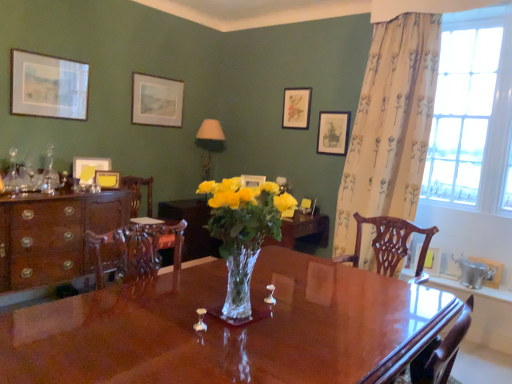
Describe the element at coordinates (89, 168) in the screenshot. Image resolution: width=512 pixels, height=384 pixels. I see `matte yellow picture frame at upper left, which is the eighth picture frame in right-to-left order` at that location.

You are a GUI agent. You are given a task and a screenshot of the screen. Output one action in this format:
    pyautogui.click(x=<x>, y=<y>)
    Task: Click on the matte white picture frame at upper left, which is the ninth picture frame in right-to-left order
    This screenshot has width=512, height=384.
    Given the screenshot: What is the action you would take?
    pyautogui.click(x=48, y=86)

What do you see at coordinates (243, 234) in the screenshot? I see `clear glass vase at center` at bounding box center [243, 234].

The width and height of the screenshot is (512, 384). Identify the location of matte white picture frame at center, acting as the sixth picture frame starting from the left. (308, 206).

Identify the location of yellow paper at left, positioned as the seventh picture frame in right-to-left order. The height and width of the screenshot is (384, 512). (106, 179).

Describe the element at coordinates (106, 179) in the screenshot. This screenshot has width=512, height=384. I see `yellow paper at left, the third picture frame when ordered from left to right` at that location.

Where is `metallic silver picture frame at lower right, the ninth picture frame in the left-to-right sequence`? Image resolution: width=512 pixels, height=384 pixels. metallic silver picture frame at lower right, the ninth picture frame in the left-to-right sequence is located at coordinates (490, 272).

Is mahogany wood cabinet at left not near matte paper picture frame at upper center, which appears as the sixth picture frame when viewed from the right?

Yes.

Is mahogany wood cabinet at left located outside matte paper picture frame at upper center, which appears as the sixth picture frame when viewed from the right?

Yes, mahogany wood cabinet at left is located beyond the bounds of matte paper picture frame at upper center, which appears as the sixth picture frame when viewed from the right.

Could you measure the distance between mahogany wood cabinet at left and matte paper picture frame at upper center, the fourth picture frame when ordered from left to right?

They are 1.30 meters apart.

Is mahogany wood cabinet at left turned away from matte paper picture frame at upper center, which appears as the sixth picture frame when viewed from the right?

mahogany wood cabinet at left is not turned away from matte paper picture frame at upper center, which appears as the sixth picture frame when viewed from the right.

Is point (330, 134) positioned before point (300, 208)?

No, it is not.

Which of these two, matte black picture frame at upper right, the 7th picture frame from the left, or matte white picture frame at center, placed as the 4th picture frame when sorted from right to left, is thinner?

Thinner between the two is matte black picture frame at upper right, the 7th picture frame from the left.

Based on the photo, considering the sizes of matte black picture frame at upper right, marked as the third picture frame in a right-to-left arrangement, and matte white picture frame at center, placed as the 4th picture frame when sorted from right to left, in the image, is matte black picture frame at upper right, marked as the third picture frame in a right-to-left arrangement, bigger or smaller than matte white picture frame at center, placed as the 4th picture frame when sorted from right to left,?

In the image, matte black picture frame at upper right, marked as the third picture frame in a right-to-left arrangement, appears to be larger than matte white picture frame at center, placed as the 4th picture frame when sorted from right to left.

This screenshot has width=512, height=384. Find the location of `houseplant in front of the clear glass window at upper right`. houseplant in front of the clear glass window at upper right is located at coordinates [243, 234].

Is clear glass vase at center with clear glass window at upper right?

clear glass vase at center and clear glass window at upper right are not in contact.

Considering the sizes of objects clear glass vase at center and clear glass window at upper right in the image provided, who is bigger, clear glass vase at center or clear glass window at upper right?

clear glass window at upper right is bigger.

Between point (241, 249) and point (437, 182), which one is positioned behind?

Positioned behind is point (437, 182).

Considering the sizes of objects matte white picture frame at upper left, which is the ninth picture frame in right-to-left order, and matte paper picture frame at upper center, the fourth picture frame when ordered from left to right, in the image provided, who is wider, matte white picture frame at upper left, which is the ninth picture frame in right-to-left order, or matte paper picture frame at upper center, the fourth picture frame when ordered from left to right,?

matte white picture frame at upper left, which is the ninth picture frame in right-to-left order, is wider.

From a real-world perspective, is matte white picture frame at upper left, which is the ninth picture frame in right-to-left order, positioned above or below matte paper picture frame at upper center, the fourth picture frame when ordered from left to right?

matte white picture frame at upper left, which is the ninth picture frame in right-to-left order, is situated lower than matte paper picture frame at upper center, the fourth picture frame when ordered from left to right, in the real world.

From their relative heights in the image, would you say matte white picture frame at upper left, which is the ninth picture frame in right-to-left order, is taller or shorter than matte paper picture frame at upper center, which appears as the sixth picture frame when viewed from the right?

matte white picture frame at upper left, which is the ninth picture frame in right-to-left order, is shorter than matte paper picture frame at upper center, which appears as the sixth picture frame when viewed from the right.

Is point (42, 107) positioned after point (323, 144)?

No, (42, 107) is in front of (323, 144).

Is matte white picture frame at upper left, the first picture frame positioned from the left, not near matte black picture frame at upper right, marked as the third picture frame in a right-to-left arrangement?

Yes, matte white picture frame at upper left, the first picture frame positioned from the left, and matte black picture frame at upper right, marked as the third picture frame in a right-to-left arrangement, are quite far apart.

Can we say matte white picture frame at upper left, which is the ninth picture frame in right-to-left order, lies outside matte black picture frame at upper right, the 7th picture frame from the left?

Indeed, matte white picture frame at upper left, which is the ninth picture frame in right-to-left order, is completely outside matte black picture frame at upper right, the 7th picture frame from the left.

Locate an element on the screen. This screenshot has height=384, width=512. the 6th picture frame to the left when counting from the matte black picture frame at upper right, the 7th picture frame from the left is located at coordinates (48, 86).

From the picture: How far apart are clear glass window at upper right and mahogany wood cabinet at left?

A distance of 9.45 feet exists between clear glass window at upper right and mahogany wood cabinet at left.

In the scene shown: From the image's perspective, who appears lower, clear glass window at upper right or mahogany wood cabinet at left?

mahogany wood cabinet at left.

Who is bigger, clear glass window at upper right or mahogany wood cabinet at left?

Bigger between the two is mahogany wood cabinet at left.

Is the surface of clear glass window at upper right in direct contact with mahogany wood cabinet at left?

No, clear glass window at upper right is not with mahogany wood cabinet at left.

From the image's perspective, is glossy wood desk at center above or below wooden picture frame at right, the 2th picture frame viewed from the right?

Clearly, from the image's perspective, glossy wood desk at center is below wooden picture frame at right, the 2th picture frame viewed from the right.

Who is smaller, glossy wood desk at center or wooden picture frame at right, the 2th picture frame viewed from the right?

wooden picture frame at right, the 2th picture frame viewed from the right, is smaller.

Which of these two, glossy wood desk at center or wooden picture frame at right, the 2th picture frame viewed from the right, is thinner?

With smaller width is wooden picture frame at right, the 2th picture frame viewed from the right.

From a real-world perspective, is glossy wood desk at center physically located above or below wooden picture frame at right, marked as the 8th picture frame in a left-to-right arrangement?

glossy wood desk at center is below wooden picture frame at right, marked as the 8th picture frame in a left-to-right arrangement.

You are a GUI agent. You are given a task and a screenshot of the screen. Output one action in this format:
    pyautogui.click(x=<x>, y=<y>)
    Task: Click on the cabinetry below the matte paper picture frame at upper center, the fourth picture frame when ordered from left to right (from a real-world perspective)
    This screenshot has height=384, width=512.
    Given the screenshot: What is the action you would take?
    pyautogui.click(x=54, y=235)

This screenshot has width=512, height=384. In order to click on the 1st picture frame counting from the right of the matte white picture frame at center, acting as the sixth picture frame starting from the left in this screenshot , I will do `click(333, 132)`.

Which object lies further to the anchor point yellow paper at left, the third picture frame when ordered from left to right, matte white picture frame at center, acting as the sixth picture frame starting from the left, or matte paper picture frame at upper center, which appears as the sixth picture frame when viewed from the right?

matte white picture frame at center, acting as the sixth picture frame starting from the left.

From the image, which object appears to be nearer to carved wood chair at center, wooden picture frame at right, marked as the 8th picture frame in a left-to-right arrangement, or glossy wood desk at center?

The object closer to carved wood chair at center is glossy wood desk at center.

When comparing their distances from clear glass vase at center, does wooden picture frame at right, the 2th picture frame viewed from the right, or matte paper picture frame at upper center, which appears as the sixth picture frame when viewed from the right, seem closer?

wooden picture frame at right, the 2th picture frame viewed from the right.

Looking at the image, which one is located closer to matte gold picture frame at upper center, the 5th picture frame from the right, floral fabric curtain at right or matte paper picture frame at upper center, the fourth picture frame when ordered from left to right?

The object closer to matte gold picture frame at upper center, the 5th picture frame from the right, is floral fabric curtain at right.

From the picture: Which object lies further to the anchor point matte yellow picture frame at upper left, which is the eighth picture frame in right-to-left order, floral fabric curtain at right or mahogany wood cabinet at left?

floral fabric curtain at right.

From the image, which object appears to be farther from matte yellow picture frame at upper left, which is the eighth picture frame in right-to-left order, wooden picture frame at right, the 2th picture frame viewed from the right, or clear glass window at upper right?

clear glass window at upper right lies further to matte yellow picture frame at upper left, which is the eighth picture frame in right-to-left order, than the other object.

Looking at the image, which one is located closer to clear glass vase at center, floral fabric curtain at right or matte yellow picture frame at upper left, which ranks as the second picture frame in left-to-right order?

floral fabric curtain at right lies closer to clear glass vase at center than the other object.

Looking at this image, considering their positions, is matte paper picture frame at upper center, the fourth picture frame when ordered from left to right, positioned further to yellow paper at left, the third picture frame when ordered from left to right, than matte white picture frame at upper left, which is the ninth picture frame in right-to-left order?

matte paper picture frame at upper center, the fourth picture frame when ordered from left to right.

Where is `curtain positioned between clear glass vase at center and wooden picture frame at right, marked as the 8th picture frame in a left-to-right arrangement, from near to far`? The width and height of the screenshot is (512, 384). curtain positioned between clear glass vase at center and wooden picture frame at right, marked as the 8th picture frame in a left-to-right arrangement, from near to far is located at coordinates (390, 125).

Where is `curtain between glossy wood desk at center and matte gold picture frame at upper center, which is the fifth picture frame in left-to-right order, along the z-axis`? curtain between glossy wood desk at center and matte gold picture frame at upper center, which is the fifth picture frame in left-to-right order, along the z-axis is located at coordinates (390, 125).

This screenshot has height=384, width=512. Find the location of `curtain positioned between glossy wood desk at center and metallic silver picture frame at lower right, acting as the 1th picture frame starting from the right, from near to far`. curtain positioned between glossy wood desk at center and metallic silver picture frame at lower right, acting as the 1th picture frame starting from the right, from near to far is located at coordinates (390, 125).

At what (x,y) coordinates should I click in order to perform the action: click on desk between matte white picture frame at upper left, which is the ninth picture frame in right-to-left order, and metallic silver picture frame at lower right, the ninth picture frame in the left-to-right sequence, from left to right. Please return your answer as a coordinate pair (x, y). Looking at the image, I should click on (229, 329).